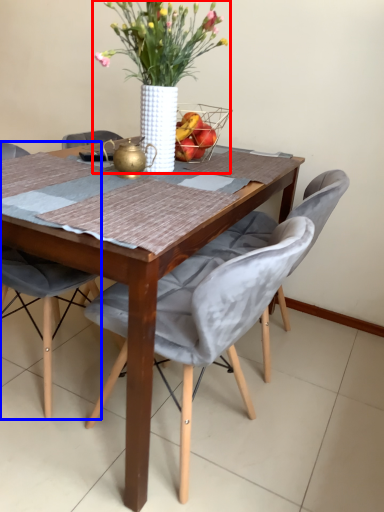
Question: Which object appears farthest to the camera in this image, houseplant (highlighted by a red box) or chair (highlighted by a blue box)?

Choices:
 (A) houseplant
 (B) chair

Answer: (B)